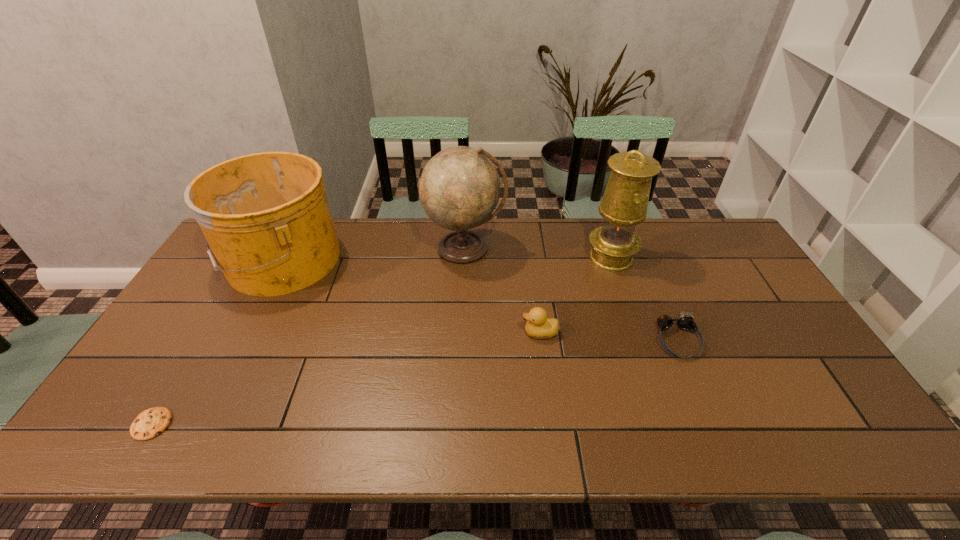
This screenshot has height=540, width=960. I want to click on bucket at the left edge, so click(266, 217).

Where is `cookie situated at the left edge`? The width and height of the screenshot is (960, 540). cookie situated at the left edge is located at coordinates (150, 423).

Locate an element on the screen. The image size is (960, 540). object situated at the far left corner is located at coordinates (266, 217).

This screenshot has width=960, height=540. Find the location of `object that is at the near left corner`. object that is at the near left corner is located at coordinates (150, 423).

At what (x,y) coordinates should I click in order to perform the action: click on free spot at the far edge of the desktop. Please return your answer as a coordinate pair (x, y). Looking at the image, I should click on point(493,234).

The height and width of the screenshot is (540, 960). I want to click on vacant space at the near edge, so click(x=213, y=448).

Find the location of a particular element. free space at the right edge of the desktop is located at coordinates (763, 288).

Image resolution: width=960 pixels, height=540 pixels. What are the coordinates of `vacant space at the near left corner of the desktop` in the screenshot? It's located at click(x=106, y=428).

Where is `free space between the third shortest object and the globe`? The width and height of the screenshot is (960, 540). free space between the third shortest object and the globe is located at coordinates (502, 291).

The image size is (960, 540). I want to click on free space between the fifth tallest object and the nearest object, so click(x=415, y=382).